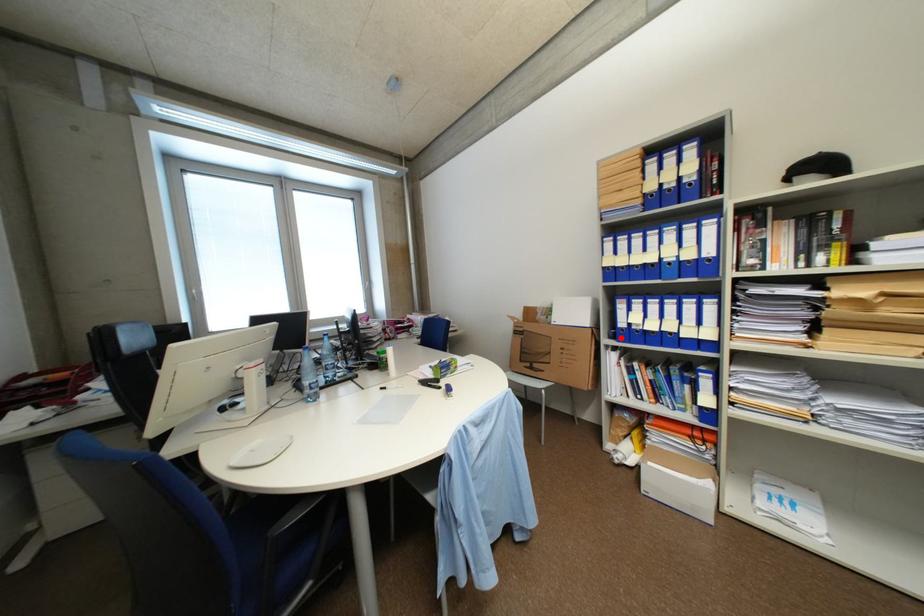
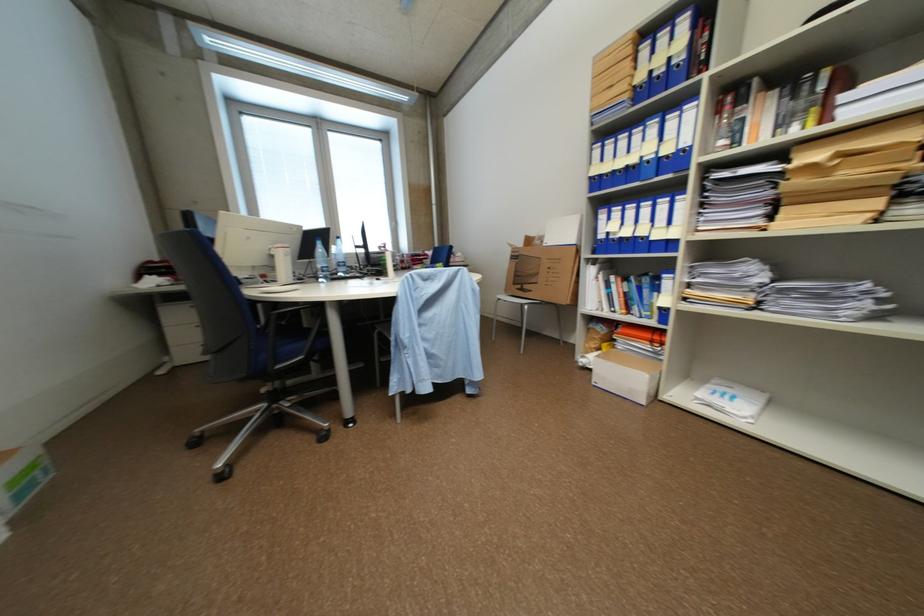
Question: I am providing you with two images of the same scene from different viewpoints. A red point is shown in image1. For the corresponding object point in image2, is it positioned nearer or farther from the camera?

Choices:
 (A) Nearer
 (B) Farther

Answer: (A)